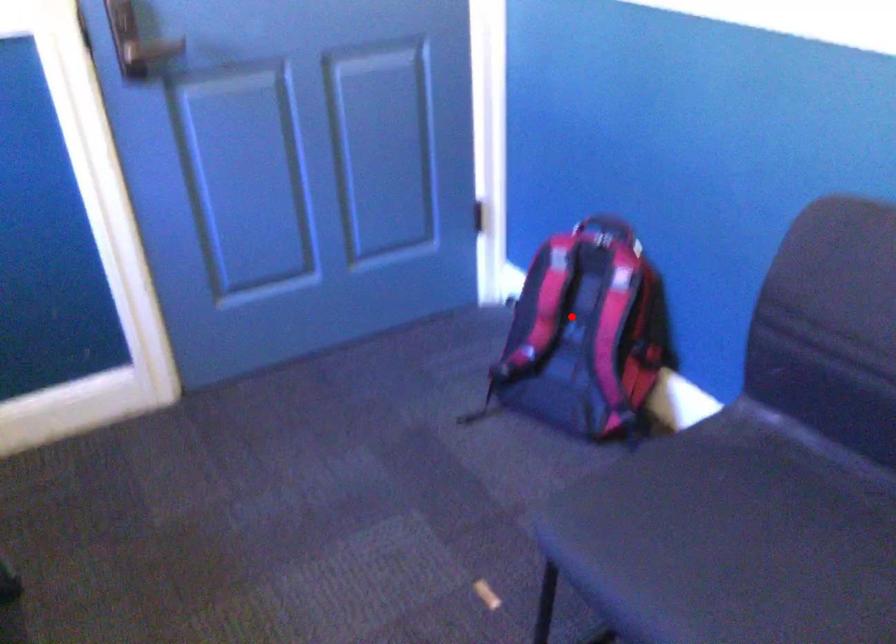
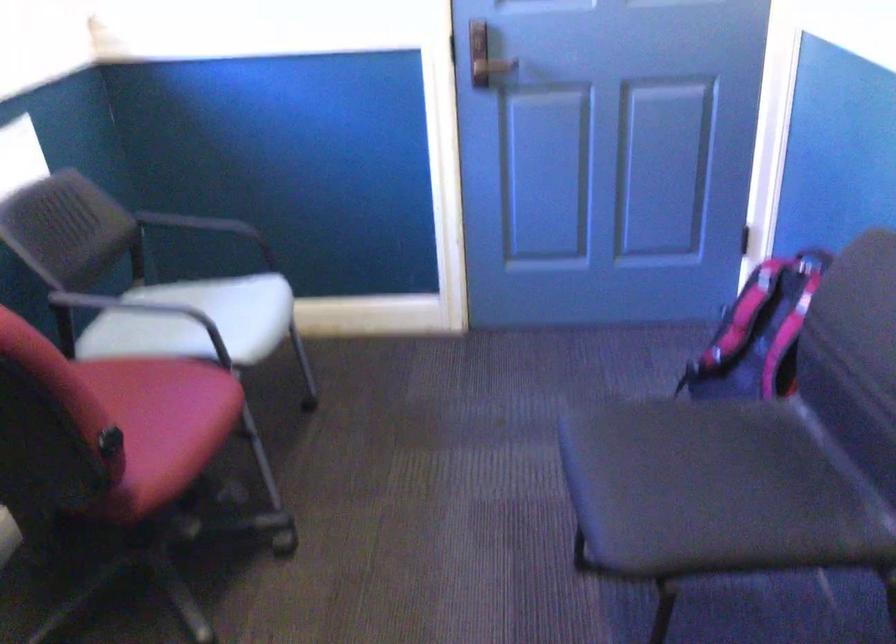
Question: I am providing you with two images of the same scene from different viewpoints. Given a red point in image1, look at the same physical point in image2. Is it:

Choices:
 (A) Closer to the viewpoint
 (B) Farther from the viewpoint

Answer: (B)